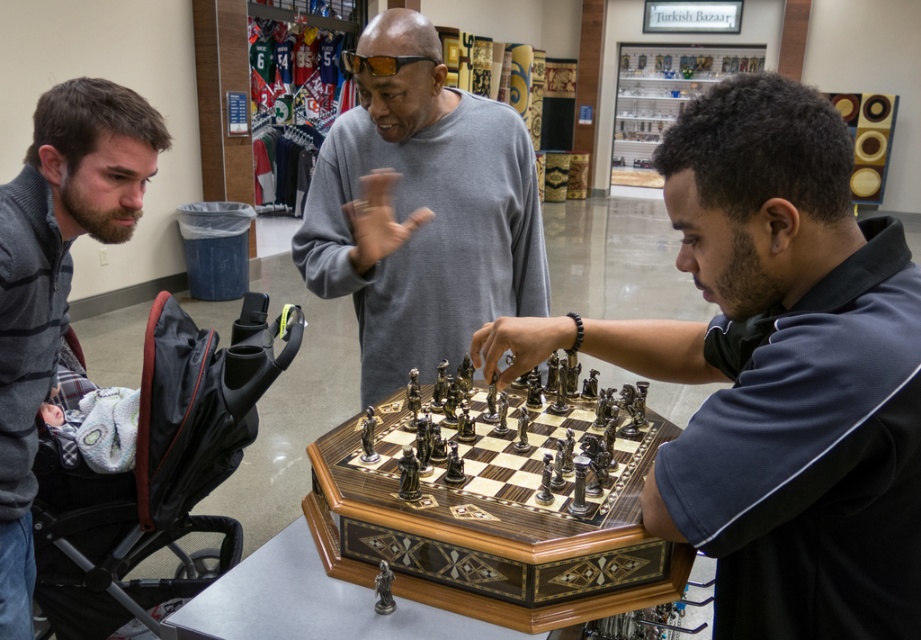
You are standing in the retail store and want to take a photo of the chessboard. You notice two points marked as point 1 at coordinate (688, 515) and point 2 at coordinate (136, 460). Which point should you focus on to ensure the chessboard is in sharp focus?

You should focus on point 1 at coordinate (688, 515) because it is closer to the camera than point 2 at coordinate (136, 460), ensuring the chessboard remains in focus.

You are standing in the retail store and want to find the gray sweater at center. According to the image coordinates, where should you look?

The gray sweater at center is located at the coordinates point (420,209).

You are a parent holding a 1.2 meter tall baby carrier. You want to place it next to the black fabric baby carriage at left and the gray sweater at left in the image. Which object should you place it next to to ensure it doesn

The black fabric baby carriage at left has a lesser height compared to gray sweater at left. Therefore, the 1.2 meter tall baby carrier should be placed next to the gray sweater at left since it is taller and will provide a better size match.